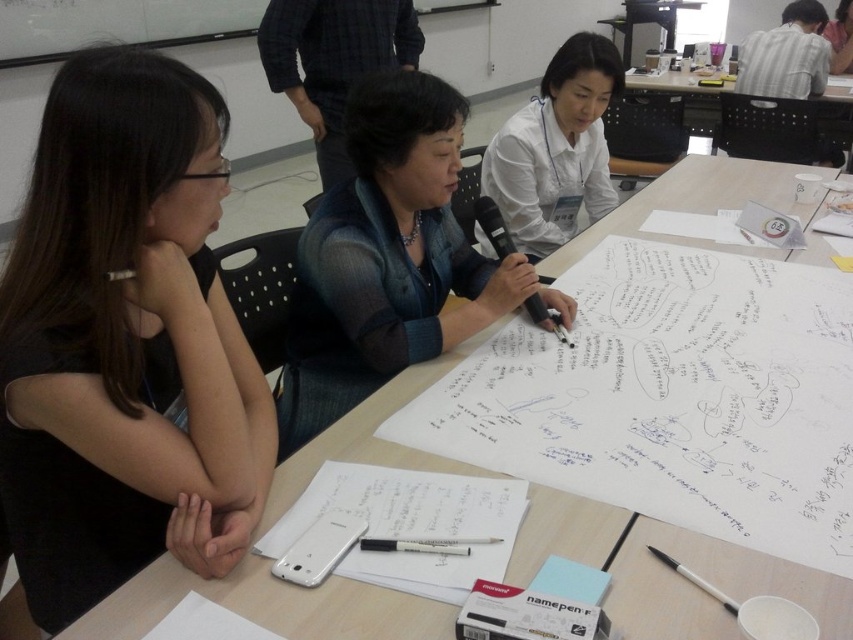
Is point (418, 243) positioned in front of point (401, 547)?

No, (418, 243) is behind (401, 547).

Does point (508, 262) come closer to viewer compared to point (424, 541)?

No, it is not.

I want to click on matte blue shirt at center, so click(x=389, y=259).

Is point (347, 298) positioned in front of point (602, 196)?

Yes.

Based on the photo, is matte blue shirt at center further to the viewer compared to white glossy shirt at upper center?

No.

Find the location of `matte blue shirt at center`. matte blue shirt at center is located at coordinates (389, 259).

This screenshot has width=853, height=640. In order to click on matte blue shirt at center in this screenshot , I will do `click(389, 259)`.

From the picture: Who is more forward, (224, 304) or (453, 468)?

Point (453, 468)

Locate an element on the screen. black matte shirt at left is located at coordinates (125, 340).

Is point (177, 307) behind point (634, 522)?

No, it is in front of (634, 522).

I want to click on black matte shirt at left, so click(125, 340).